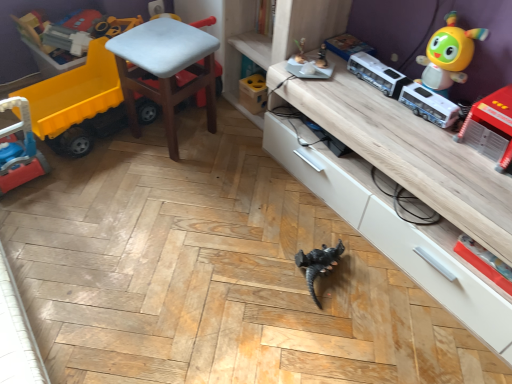
Locate an element on the screen. free spot above white plastic chair at center (from a real-world perspective) is located at coordinates (164, 38).